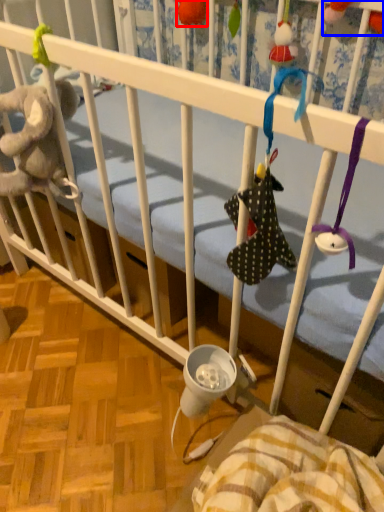
Question: Which object is closer to the camera taking this photo, toy (highlighted by a red box) or toy (highlighted by a blue box)?

Choices:
 (A) toy
 (B) toy

Answer: (B)